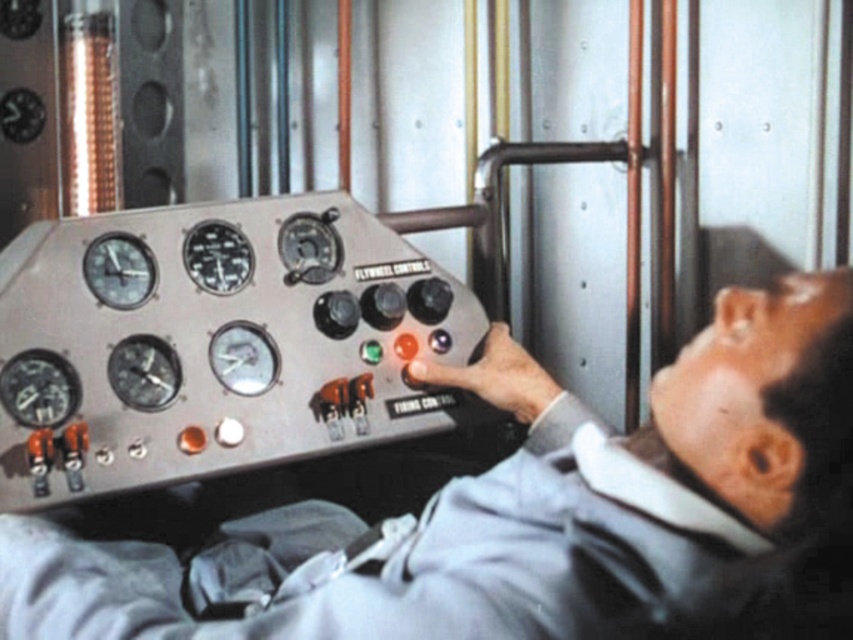
You are an engineer inspecting a control room. You need to adjust a setting on the metallic gray control panel at center. However, you notice a metallic clock at upper left nearby. Which object should you interact with first if you want to make sure you complete the task before the clock reaches a certain time?

You should interact with the metallic gray control panel at center first because it is larger in size than the metallic clock at upper left, making it more prominent and likely the primary control interface for adjustments.

You are an engineer inspecting a control room. You notice the metallic gray control panel at center and the metallic clock at upper left. Which object is closer to you?

The metallic gray control panel at center is closer to you because it is in front of the metallic clock at upper left.

You are an engineer who needs to adjust the settings on the metallic gray control panel at center and the metallic gauge at center. Since you can only reach one at a time, which one should you adjust first based on their positions?

The metallic gauge at center should be adjusted first because the metallic gray control panel at center is positioned to its right, meaning the gauge is closer to your left side and thus more accessible without moving your body.